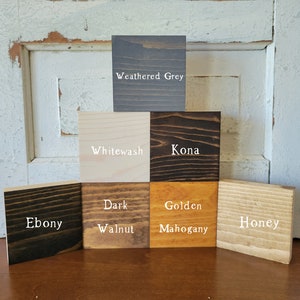
In order to click on wood grain lines in this screenshot , I will do `click(54, 197)`, `click(97, 196)`, `click(242, 201)`, `click(260, 214)`, `click(106, 129)`, `click(123, 131)`, `click(154, 93)`, `click(141, 89)`, `click(191, 115)`, `click(194, 127)`.